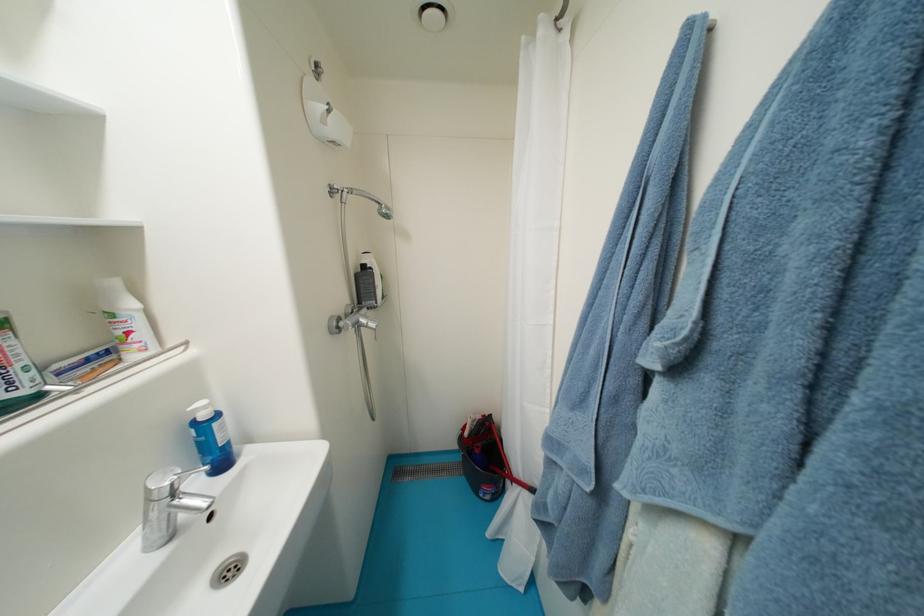
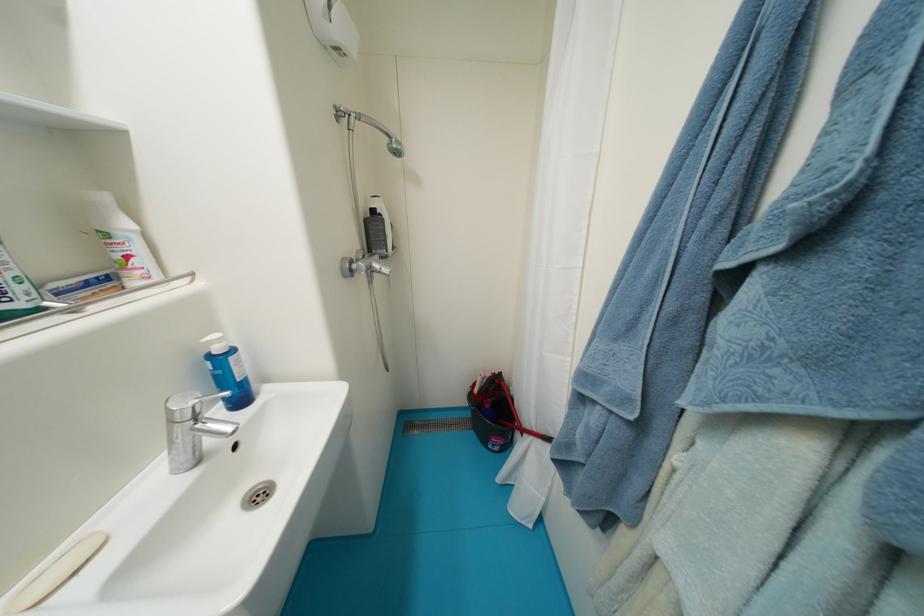
Where in the second image is the point corresponding to pixel 370 323 from the first image?

(383, 267)